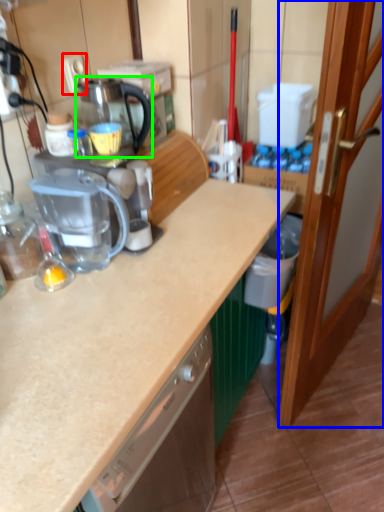
Question: Estimate the real-world distances between objects in this image. Which object is closer to electric outlet (highlighted by a red box), door (highlighted by a blue box) or coffeepot (highlighted by a green box)?

Choices:
 (A) door
 (B) coffeepot

Answer: (B)